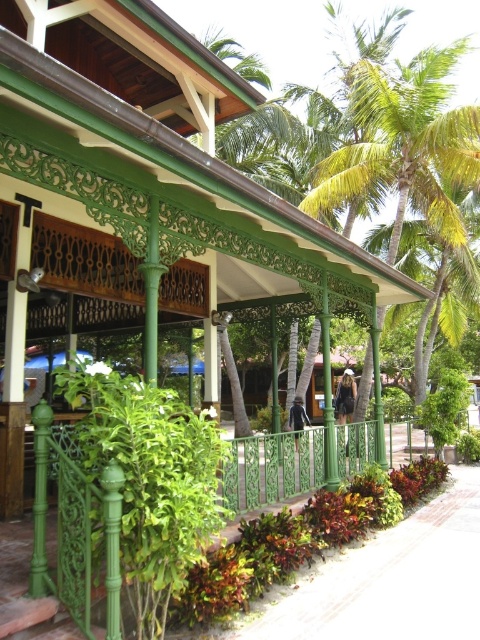
Question: Which object is positioned closest to the dark blue fabric at center?

Choices:
 (A) green wrought iron fence at lower left
 (B) dark brown leather jacket at center

Answer: (B)

Question: Is green leafy palm tree at center below dark blue fabric at center?

Choices:
 (A) yes
 (B) no

Answer: (A)

Question: Estimate the real-world distances between objects in this image. Which object is closer to the green leafy palm tree at center?

Choices:
 (A) dark brown leather jacket at center
 (B) green wrought iron fence at lower left
 (C) dark blue fabric at center

Answer: (C)

Question: Does green leafy palm tree at center have a smaller size compared to dark blue fabric at center?

Choices:
 (A) no
 (B) yes

Answer: (B)

Question: Does green leafy palm tree at center appear over green wrought iron fence at lower left?

Choices:
 (A) yes
 (B) no

Answer: (A)

Question: Among these points, which one is farthest from the camera?

Choices:
 (A) (292, 426)
 (B) (350, 163)
 (C) (0, 563)
 (D) (349, 388)

Answer: (D)